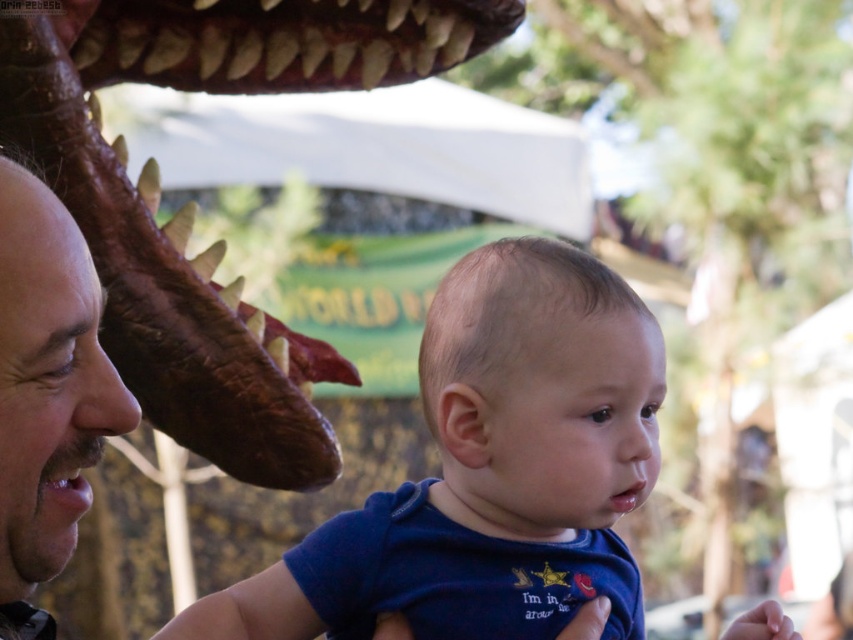
Question: Can you confirm if blue cotton shirt at center is positioned to the left of smooth brown leather face at left?

Choices:
 (A) no
 (B) yes

Answer: (A)

Question: Does blue cotton shirt at center appear on the right side of smooth brown leather face at left?

Choices:
 (A) yes
 (B) no

Answer: (A)

Question: Which point appears farthest from the camera in this image?

Choices:
 (A) (42, 554)
 (B) (469, 468)

Answer: (B)

Question: Which of the following is the farthest from the observer?

Choices:
 (A) brown textured head at upper left
 (B) blue cotton shirt at center
 (C) smooth brown leather face at left

Answer: (A)

Question: Is blue cotton shirt at center below smooth brown leather face at left?

Choices:
 (A) no
 (B) yes

Answer: (B)

Question: Which of the following is the closest to the observer?

Choices:
 (A) (634, 436)
 (B) (100, 273)

Answer: (A)